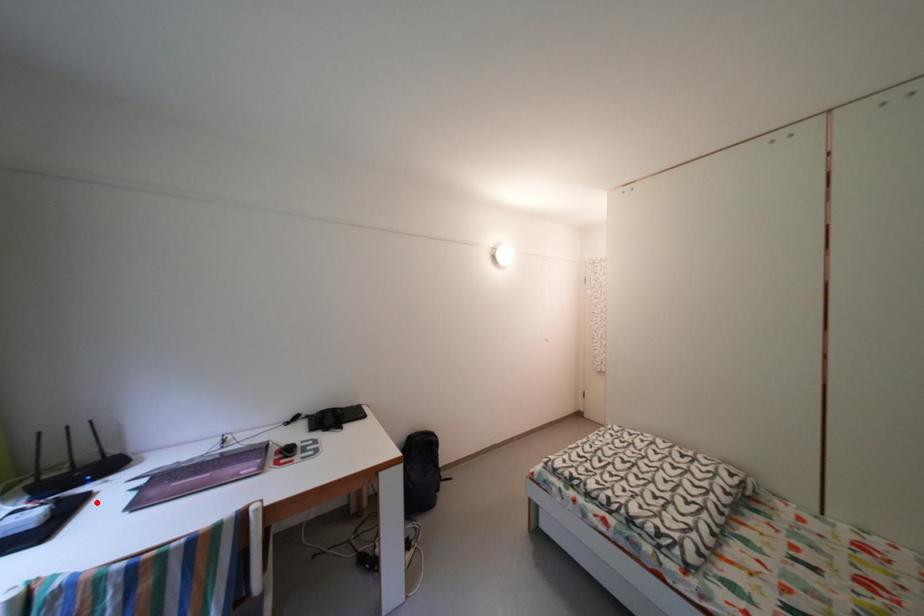
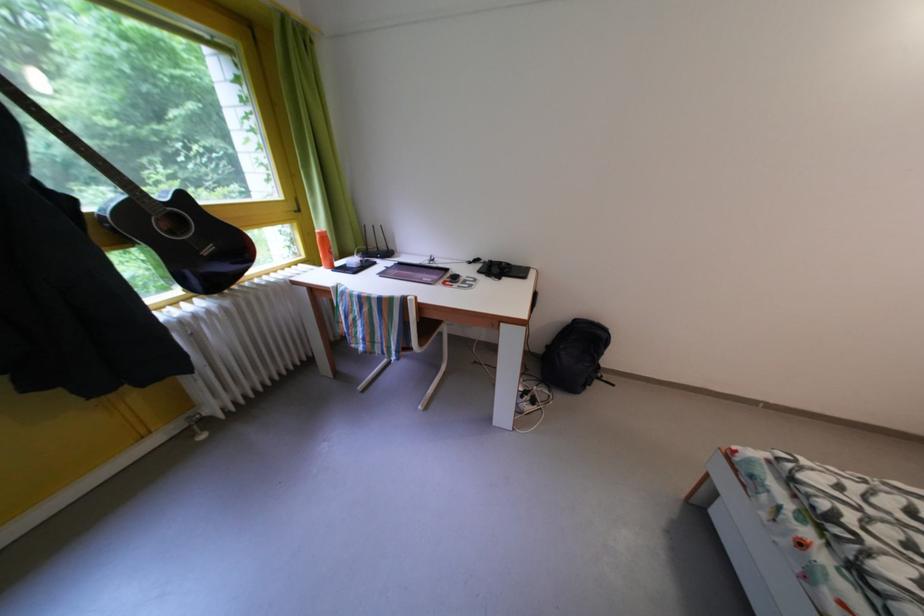
Find the pixel in the second image that matches the highlighted location in the first image.

(383, 270)